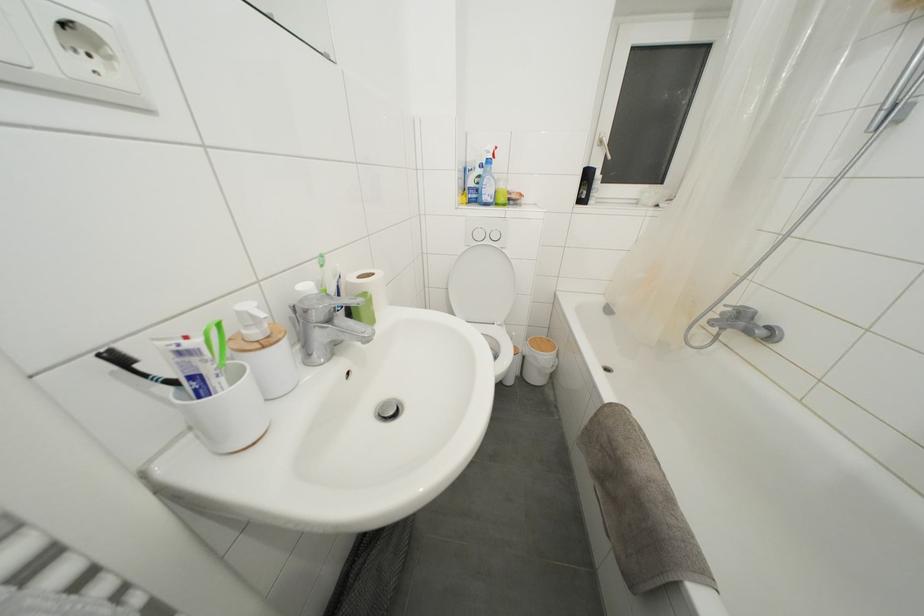
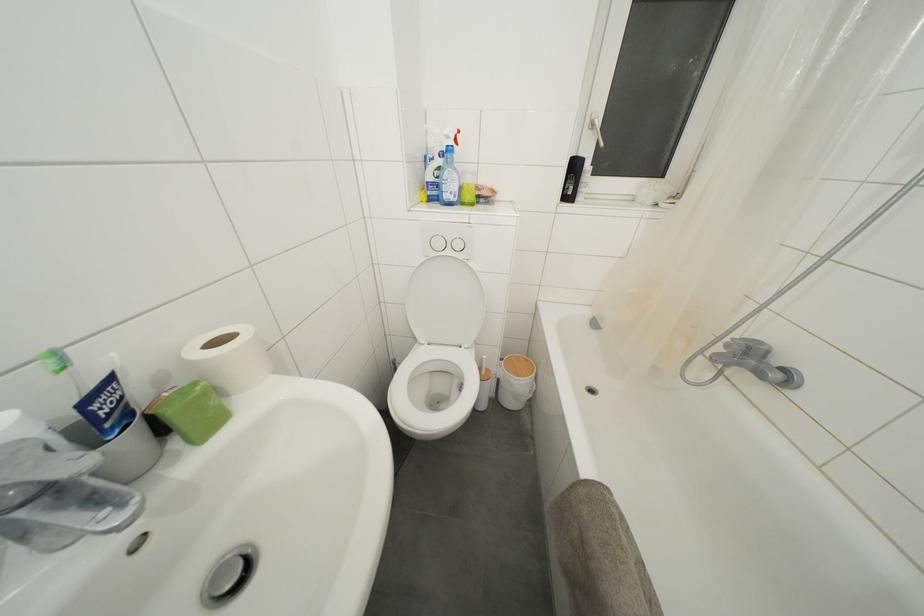
Where in the second image is the point corresponding to (395,418) from the first image?

(233, 592)